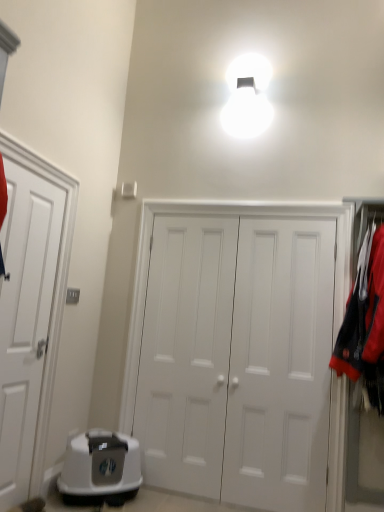
Describe the element at coordinates (238, 360) in the screenshot. I see `white matte door at center, arranged as the first door when viewed from the right` at that location.

Image resolution: width=384 pixels, height=512 pixels. In order to click on white matte door at center, placed as the 2th door when sorted from right to left in this screenshot , I will do `click(186, 353)`.

Locate an element on the screen. white matte door at left, marked as the first door in a left-to-right arrangement is located at coordinates (25, 317).

Find the location of a particular element. Image resolution: width=384 pixels, height=512 pixels. white matte door at center, arranged as the first door when viewed from the right is located at coordinates (238, 360).

From the white matte door at center, arranged as the first door when viewed from the right, count the 1st door to the left and point to it. Please provide its 2D coordinates.

[(186, 353)]

Consider the image. Based on their sizes in the image, would you say white matte door at center, arranged as the first door when viewed from the right, is bigger or smaller than white matte door at center, placed as the 2th door when sorted from right to left?

In the image, white matte door at center, arranged as the first door when viewed from the right, appears to be larger than white matte door at center, placed as the 2th door when sorted from right to left.

Measure the distance from white matte door at center, which is counted as the 3th door, starting from the left, to white matte door at center, marked as the 2th door in a left-to-right arrangement.

Answer: white matte door at center, which is counted as the 3th door, starting from the left, is 5.56 inches away from white matte door at center, marked as the 2th door in a left-to-right arrangement.

Does white matte door at center, arranged as the first door when viewed from the right, have a lesser height compared to white matte door at center, placed as the 2th door when sorted from right to left?

No.

How different are the orientations of white matte door at left, marked as the first door in a left-to-right arrangement, and white matte door at center, marked as the 2th door in a left-to-right arrangement, in degrees?

They differ by 88.9 degrees in their facing directions.

From a real-world perspective, who is located higher, white matte door at left, marked as the first door in a left-to-right arrangement, or white matte door at center, placed as the 2th door when sorted from right to left?

white matte door at left, marked as the first door in a left-to-right arrangement, is physically above.

From the image's perspective, between white matte door at left, the 3th door positioned from the right, and white matte door at center, marked as the 2th door in a left-to-right arrangement, which one is located above?

white matte door at left, the 3th door positioned from the right.

Is white matte door at center, marked as the 2th door in a left-to-right arrangement, outside of white matte door at left, the 3th door positioned from the right?

Yes, white matte door at center, marked as the 2th door in a left-to-right arrangement, is located beyond the bounds of white matte door at left, the 3th door positioned from the right.

Considering the relative sizes of white matte door at center, placed as the 2th door when sorted from right to left, and white matte door at left, the 3th door positioned from the right, in the image provided, is white matte door at center, placed as the 2th door when sorted from right to left, shorter than white matte door at left, the 3th door positioned from the right,?

No, white matte door at center, placed as the 2th door when sorted from right to left, is not shorter than white matte door at left, the 3th door positioned from the right.

Identify the location of door that is the 2nd object located below the white matte door at left, marked as the first door in a left-to-right arrangement (from the image's perspective). (186, 353).

Relative to white matte door at left, the 3th door positioned from the right, is white matte door at center, placed as the 2th door when sorted from right to left, in front or behind?

white matte door at center, placed as the 2th door when sorted from right to left, is positioned farther from the viewer than white matte door at left, the 3th door positioned from the right.

From the image's perspective, which object appears higher, white matte door at center, placed as the 2th door when sorted from right to left, or white plastic litter box at lower left?

white matte door at center, placed as the 2th door when sorted from right to left.

What's the angular difference between white matte door at center, marked as the 2th door in a left-to-right arrangement, and white plastic litter box at lower left's facing directions?

The facing directions of white matte door at center, marked as the 2th door in a left-to-right arrangement, and white plastic litter box at lower left are 47 degrees apart.

Is white matte door at center, placed as the 2th door when sorted from right to left, next to white plastic litter box at lower left and touching it?

No.

Looking at this image, from a real-world perspective, relative to white plastic litter box at lower left, is white matte door at center, marked as the 2th door in a left-to-right arrangement, vertically above or below?

In terms of real-world spatial position, white matte door at center, marked as the 2th door in a left-to-right arrangement, is above white plastic litter box at lower left.

Is white plastic litter box at lower left far away from white matte door at center, marked as the 2th door in a left-to-right arrangement?

Actually, white plastic litter box at lower left and white matte door at center, marked as the 2th door in a left-to-right arrangement, are a little close together.

Considering the relative sizes of white plastic litter box at lower left and white matte door at center, placed as the 2th door when sorted from right to left, in the image provided, is white plastic litter box at lower left bigger than white matte door at center, placed as the 2th door when sorted from right to left,?

Yes.

In the scene shown: Is white plastic litter box at lower left taller or shorter than white matte door at center, placed as the 2th door when sorted from right to left?

In the image, white plastic litter box at lower left appears to be shorter than white matte door at center, placed as the 2th door when sorted from right to left.

Which object is positioned more to the left, white plastic litter box at lower left or white matte door at center, marked as the 2th door in a left-to-right arrangement?

white plastic litter box at lower left.

Could you tell me if white matte door at center, which is counted as the 3th door, starting from the left, is turned towards white matte door at left, marked as the first door in a left-to-right arrangement?

Yes, white matte door at center, which is counted as the 3th door, starting from the left, is aimed at white matte door at left, marked as the first door in a left-to-right arrangement.

Consider the image. Can you confirm if white matte door at center, which is counted as the 3th door, starting from the left, is bigger than white matte door at left, marked as the first door in a left-to-right arrangement?

Yes, white matte door at center, which is counted as the 3th door, starting from the left, is bigger than white matte door at left, marked as the first door in a left-to-right arrangement.

Which object is positioned more to the left, white matte door at center, arranged as the first door when viewed from the right, or white matte door at left, marked as the first door in a left-to-right arrangement?

Positioned to the left is white matte door at left, marked as the first door in a left-to-right arrangement.

Is white matte door at center, arranged as the first door when viewed from the right, with white matte door at left, marked as the first door in a left-to-right arrangement?

No, white matte door at center, arranged as the first door when viewed from the right, is not next to white matte door at left, marked as the first door in a left-to-right arrangement.

Does white matte door at center, placed as the 2th door when sorted from right to left, contain white matte door at center, which is counted as the 3th door, starting from the left?

Yes, white matte door at center, which is counted as the 3th door, starting from the left, is surrounded by white matte door at center, placed as the 2th door when sorted from right to left.

Considering the relative sizes of white matte door at center, placed as the 2th door when sorted from right to left, and white matte door at center, arranged as the first door when viewed from the right, in the image provided, is white matte door at center, placed as the 2th door when sorted from right to left, bigger than white matte door at center, arranged as the first door when viewed from the right,?

No.

From the image's perspective, which one is positioned higher, white matte door at center, marked as the 2th door in a left-to-right arrangement, or white matte door at center, which is counted as the 3th door, starting from the left?

white matte door at center, which is counted as the 3th door, starting from the left, from the image's perspective.

Where is `door to the right of white matte door at center, marked as the 2th door in a left-to-right arrangement`? This screenshot has width=384, height=512. door to the right of white matte door at center, marked as the 2th door in a left-to-right arrangement is located at coordinates (238, 360).

The width and height of the screenshot is (384, 512). Find the location of `the 2nd door behind the white matte door at left, the 3th door positioned from the right, starting your count from the anchor`. the 2nd door behind the white matte door at left, the 3th door positioned from the right, starting your count from the anchor is located at coordinates (186, 353).

From the picture: Which object lies nearer to the anchor point white matte door at left, the 3th door positioned from the right, white matte door at center, marked as the 2th door in a left-to-right arrangement, or white matte door at center, arranged as the first door when viewed from the right?

white matte door at center, marked as the 2th door in a left-to-right arrangement, lies closer to white matte door at left, the 3th door positioned from the right, than the other object.

When comparing their distances from white plastic litter box at lower left, does white matte door at left, the 3th door positioned from the right, or white matte door at center, placed as the 2th door when sorted from right to left, seem closer?

white matte door at center, placed as the 2th door when sorted from right to left, is positioned closer to the anchor white plastic litter box at lower left.

When comparing their distances from white matte door at center, which is counted as the 3th door, starting from the left, does white matte door at center, marked as the 2th door in a left-to-right arrangement, or white matte door at left, the 3th door positioned from the right, seem further?

Among the two, white matte door at left, the 3th door positioned from the right, is located further to white matte door at center, which is counted as the 3th door, starting from the left.

From the image, which object appears to be nearer to white matte door at center, placed as the 2th door when sorted from right to left, white matte door at center, which is counted as the 3th door, starting from the left, or white plastic litter box at lower left?

white matte door at center, which is counted as the 3th door, starting from the left, lies closer to white matte door at center, placed as the 2th door when sorted from right to left, than the other object.

Based on their spatial positions, is white matte door at center, which is counted as the 3th door, starting from the left, or white matte door at center, marked as the 2th door in a left-to-right arrangement, further from white matte door at left, the 3th door positioned from the right?

white matte door at center, which is counted as the 3th door, starting from the left, lies further to white matte door at left, the 3th door positioned from the right, than the other object.

From the image, which object appears to be farther from white plastic litter box at lower left, white matte door at center, which is counted as the 3th door, starting from the left, or white matte door at left, marked as the first door in a left-to-right arrangement?

The object further to white plastic litter box at lower left is white matte door at center, which is counted as the 3th door, starting from the left.

When comparing their distances from white plastic litter box at lower left, does white matte door at center, which is counted as the 3th door, starting from the left, or white matte door at center, placed as the 2th door when sorted from right to left, seem closer?

The object closer to white plastic litter box at lower left is white matte door at center, placed as the 2th door when sorted from right to left.

Considering their positions, is white plastic litter box at lower left positioned further to white matte door at center, arranged as the first door when viewed from the right, than white matte door at left, marked as the first door in a left-to-right arrangement?

Based on the image, white matte door at left, marked as the first door in a left-to-right arrangement, appears to be further to white matte door at center, arranged as the first door when viewed from the right.

Locate an element on the screen. The width and height of the screenshot is (384, 512). door between white matte door at left, the 3th door positioned from the right, and white matte door at center, arranged as the first door when viewed from the right is located at coordinates (186, 353).

At what (x,y) coordinates should I click in order to perform the action: click on door between white plastic litter box at lower left and white matte door at center, which is counted as the 3th door, starting from the left, in the horizontal direction. Please return your answer as a coordinate pair (x, y). The width and height of the screenshot is (384, 512). Looking at the image, I should click on (186, 353).

The image size is (384, 512). Find the location of `appliance located between white matte door at left, the 3th door positioned from the right, and white matte door at center, which is counted as the 3th door, starting from the left, in the left-right direction`. appliance located between white matte door at left, the 3th door positioned from the right, and white matte door at center, which is counted as the 3th door, starting from the left, in the left-right direction is located at coordinates (101, 467).

Where is `appliance positioned between white matte door at left, the 3th door positioned from the right, and white matte door at center, placed as the 2th door when sorted from right to left, from near to far`? appliance positioned between white matte door at left, the 3th door positioned from the right, and white matte door at center, placed as the 2th door when sorted from right to left, from near to far is located at coordinates (101, 467).